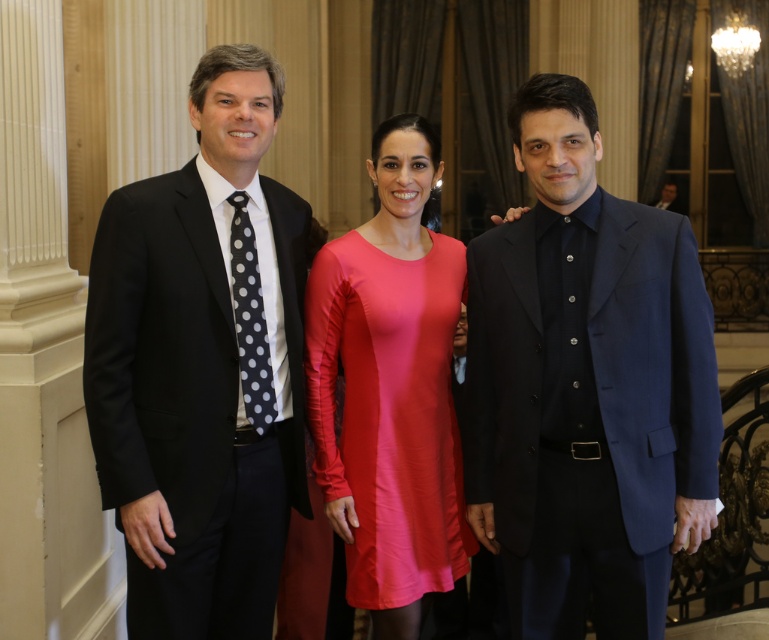
You are standing in the grand room and want to move from point A at point (544,624) to point B at point (92,324). Which direction should you move to get closer to point B?

To move from point A at point (544,624) to point B at point (92,324), you should move downward and to the left since point B is located lower and to the left of point A.

You are a photographer setting up for a group photo in the grand room. You notice the matte blue suit at center and the matte pink dress at center. Which one is placed higher in the frame?

The matte blue suit at center is positioned over the matte pink dress at center, meaning it is higher in the frame.

You are a photographer at a formal event. You need to capture a closeup shot of the matte pink dress at center while keeping the black dotted tie at left visible in the background. Can you position yourself close enough to the dress to focus on it without moving the subjects? Explain your reasoning.

The matte pink dress at center is 30.85 inches away from the black dotted tie at left. Since this distance allows for a closeup of the dress while still keeping the tie in the background, positioning yourself approximately 30.85 inches away from the dress should work. This distance maintains both the focus on the dress and the visibility of the tie without needing to move the subjects.